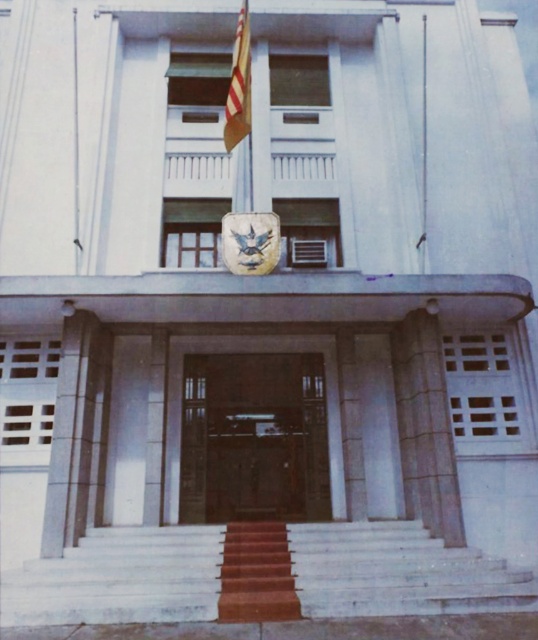
You are standing at the entrance of the building and want to reach the maroon carpeted stairs at center. In which direction should you move relative to the entrance?

The maroon carpeted stairs at center are located at point coordinates relative to the entrance, but since the stairs are at the center, you should move forward towards the stairs from the entrance.

You are a visitor approaching the building and want to enter through the main entrance. Based on the image, where is the brown wooden door at center in relation to the metallic flag pole at center?

The brown wooden door at center is located below the metallic flag pole at center, so the door is positioned lower than the flag pole.